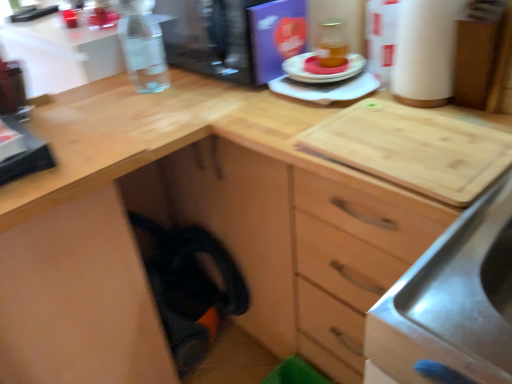
Image resolution: width=512 pixels, height=384 pixels. Identify the location of vacant space to the left of clear glass bottle at upper left. [x=93, y=94].